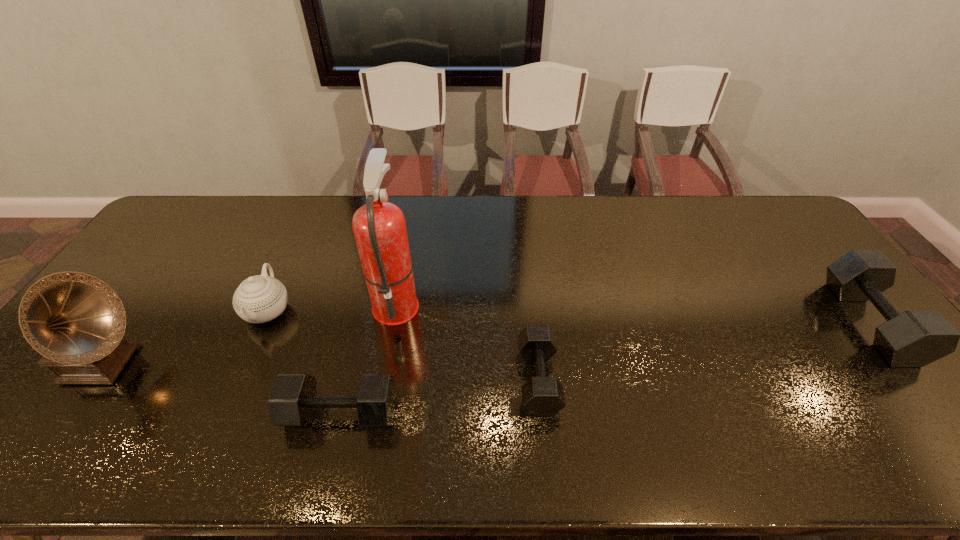
Find the location of a particular element. Image resolution: width=960 pixels, height=540 pixels. free spot between the leftmost dumbbell and the chinaware is located at coordinates pos(304,362).

You are a GUI agent. You are given a task and a screenshot of the screen. Output one action in this format:
    pyautogui.click(x=<x>, y=<y>)
    Task: Click on the free spot between the shortest object and the second shortest object
    Image resolution: width=960 pixels, height=540 pixels.
    Given the screenshot: What is the action you would take?
    pyautogui.click(x=440, y=396)

Identify the location of blank region between the shortest object and the chinaware. (403, 345).

I want to click on object identified as the closest to the leftmost dumbbell, so click(379, 227).

Find the location of a particular element. The width and height of the screenshot is (960, 540). the second closest object to the fifth shortest object is located at coordinates (293, 399).

Identify which dumbbell is the closest to the rightmost object. Please provide its 2D coordinates. Your answer should be formatted as a tuple, i.e. [(x, y)], where the tuple contains the x and y coordinates of a point satisfying the conditions above.

[(542, 395)]

Identify which dumbbell is the nearest to the tallest object. Please provide its 2D coordinates. Your answer should be formatted as a tuple, i.e. [(x, y)], where the tuple contains the x and y coordinates of a point satisfying the conditions above.

[(293, 399)]

Where is `free point that satisfies the following two spatial constraints: 1. on the spout of the second shortest object; 2. on the left side of the chinaware`? free point that satisfies the following two spatial constraints: 1. on the spout of the second shortest object; 2. on the left side of the chinaware is located at coordinates (222, 413).

The width and height of the screenshot is (960, 540). What are the coordinates of `vacant area in the image that satisfies the following two spatial constraints: 1. on the horn of the leftmost object; 2. on the back side of the shortest object` in the screenshot? It's located at (91, 379).

Identify the location of free space that satisfies the following two spatial constraints: 1. on the back side of the rightmost dumbbell; 2. on the right side of the shortest dumbbell. This screenshot has height=540, width=960. (532, 322).